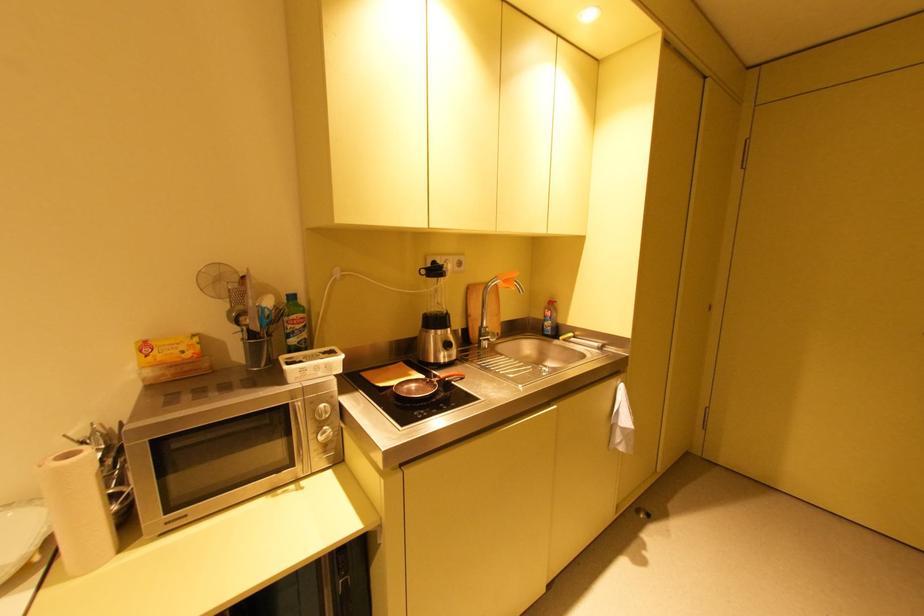
Find where to pull the white electrical plug. Please return your answer as a coordinate pair (x, y).

(447, 262)